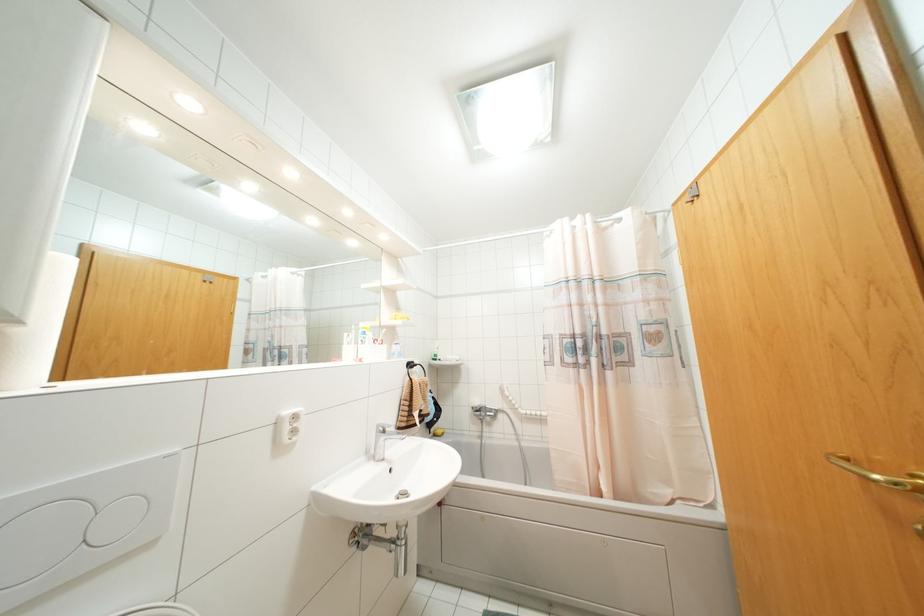
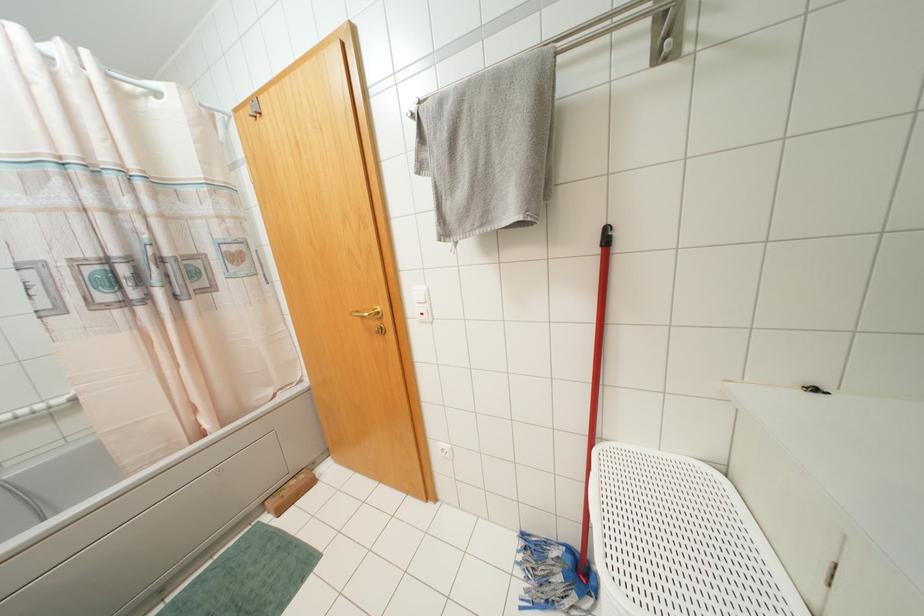
Question: The camera is either moving clockwise (left) or counter-clockwise (right) around the object. The first image is from the beginning of the video and the second image is from the end. Is the camera moving left or right when shooting the video?

Choices:
 (A) Left
 (B) Right

Answer: (A)